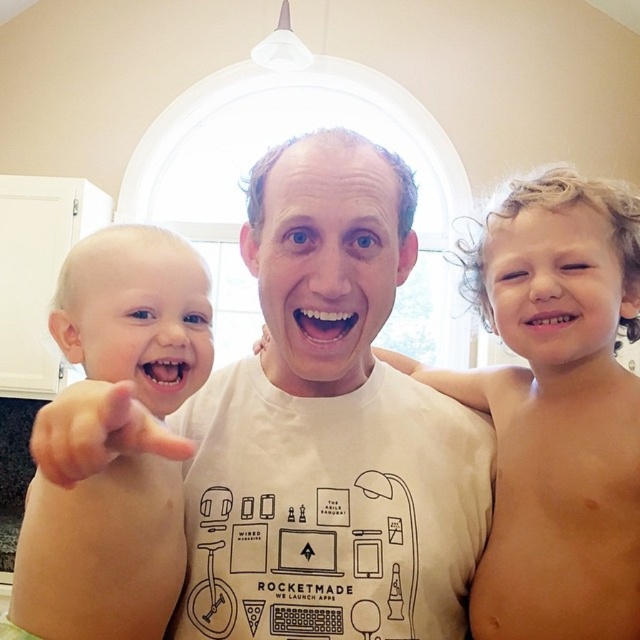
Is white cotton t-shirt at center behind smooth skin baby at left?

Yes, white cotton t-shirt at center is behind smooth skin baby at left.

Which is more to the right, white cotton t-shirt at center or smooth skin baby at left?

Positioned to the right is white cotton t-shirt at center.

Where is `white cotton t-shirt at center`? The width and height of the screenshot is (640, 640). white cotton t-shirt at center is located at coordinates (330, 428).

Can you confirm if smooth skin baby at left is positioned below pink flesh-toned hand at left?

Yes.

Does smooth skin baby at left lie behind pink flesh-toned hand at left?

Yes.

Who is more distant from viewer, (67, 346) or (90, 442)?

The point (67, 346) is behind.

The image size is (640, 640). I want to click on smooth skin baby at left, so click(100, 554).

Locate an element on the screen. The height and width of the screenshot is (640, 640). blonde hair boy at right is located at coordinates (556, 410).

Between blonde hair boy at right and pink flesh-toned hand at left, which one appears on the right side from the viewer's perspective?

blonde hair boy at right

Does point (513, 401) lie behind point (125, 442)?

Yes, it is.

Where is `blonde hair boy at right`? The image size is (640, 640). blonde hair boy at right is located at coordinates (556, 410).